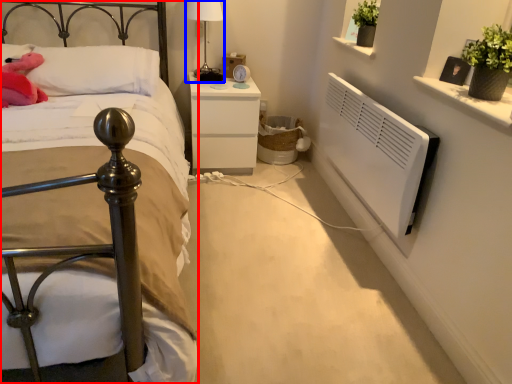
Question: Among these objects, which one is farthest to the camera, bed (highlighted by a red box) or bedside lamp (highlighted by a blue box)?

Choices:
 (A) bed
 (B) bedside lamp

Answer: (B)